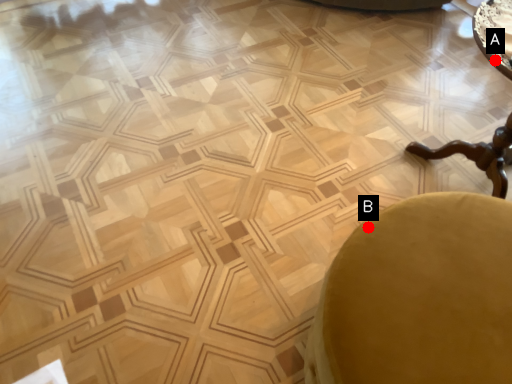
Question: Two points are circled on the image, labeled by A and B beside each circle. Which point appears closest to the camera in this image?

Choices:
 (A) A is closer
 (B) B is closer

Answer: (B)